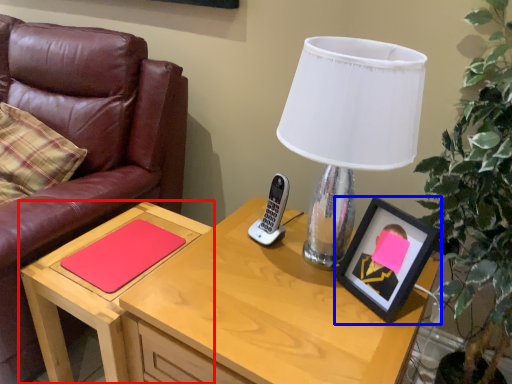
Question: Which of the following is the closest to the observer, table (highlighted by a red box) or picture frame (highlighted by a blue box)?

Choices:
 (A) table
 (B) picture frame

Answer: (B)